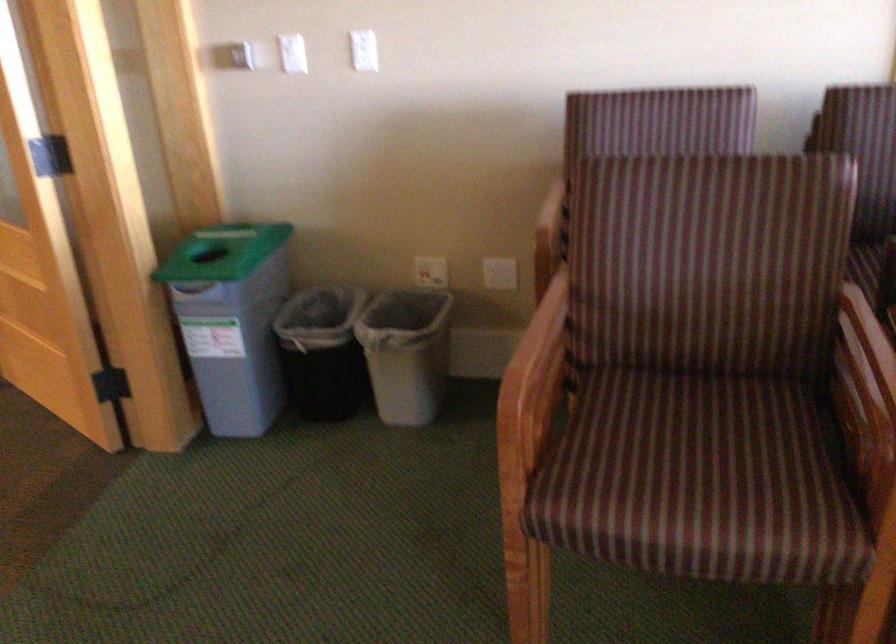
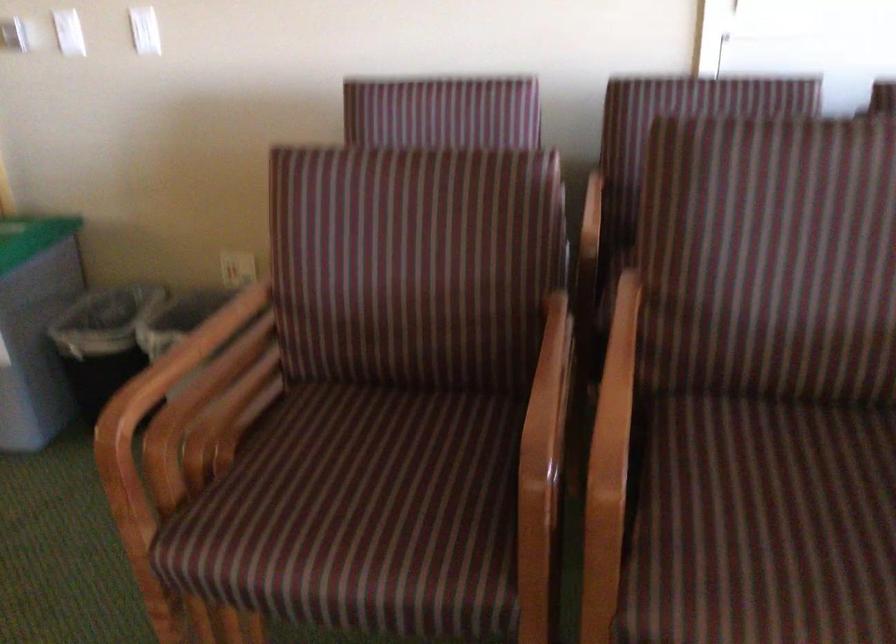
Question: The camera is either moving clockwise (left) or counter-clockwise (right) around the object. The first image is from the beginning of the video and the second image is from the end. Is the camera moving left or right when shooting the video?

Choices:
 (A) Left
 (B) Right

Answer: (A)